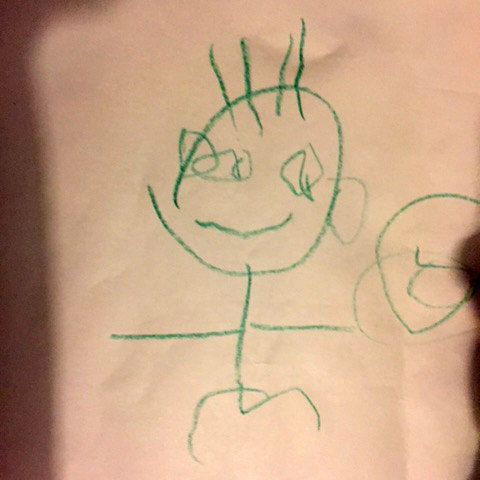
The image size is (480, 480). I want to click on artwork, so click(x=319, y=413).